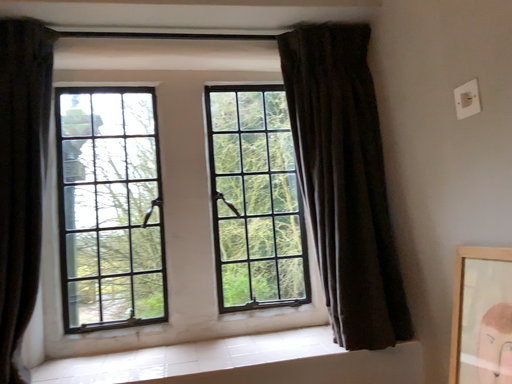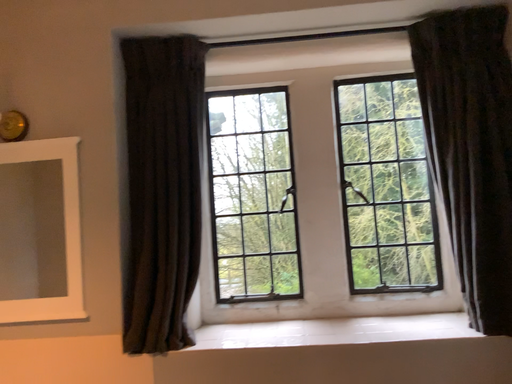
Question: How did the camera likely rotate when shooting the video?

Choices:
 (A) rotated left
 (B) rotated right

Answer: (A)